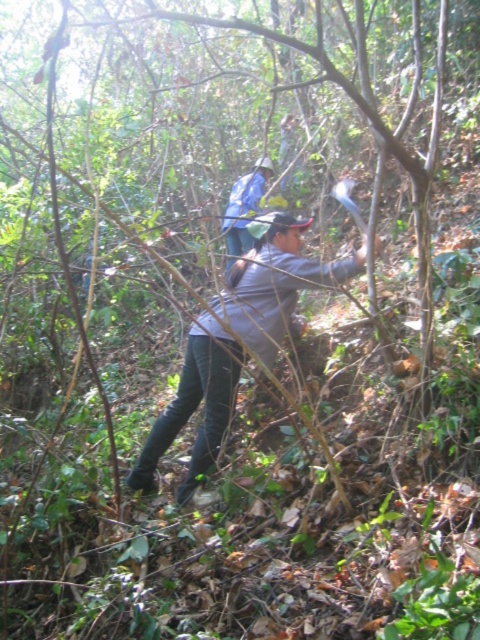
Question: Which point appears farthest from the camera in this image?

Choices:
 (A) (252, 272)
 (B) (229, 259)

Answer: (B)

Question: Is gray fabric shirt at center positioned in front of blue fabric shirt at center?

Choices:
 (A) no
 (B) yes

Answer: (B)

Question: Which object appears farthest from the camera in this image?

Choices:
 (A) blue fabric shirt at center
 (B) gray fabric shirt at center

Answer: (A)

Question: Which point is farther from the camera taking this photo?

Choices:
 (A) (189, 388)
 (B) (239, 198)

Answer: (B)

Question: Can you confirm if gray fabric shirt at center is wider than blue fabric shirt at center?

Choices:
 (A) no
 (B) yes

Answer: (B)

Question: Does gray fabric shirt at center have a lesser width compared to blue fabric shirt at center?

Choices:
 (A) no
 (B) yes

Answer: (A)